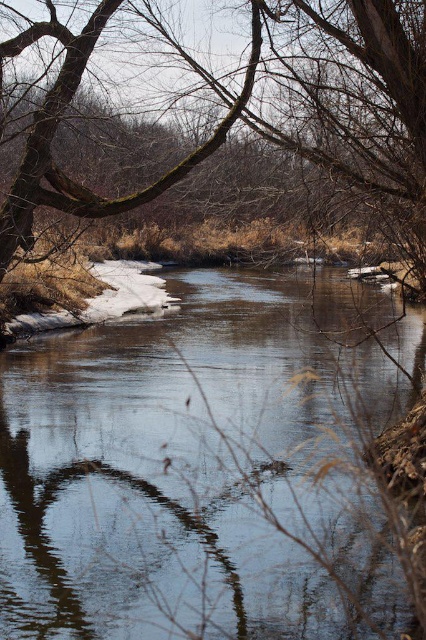
Question: Does clear water at center come behind brown mossy branch at upper left?

Choices:
 (A) yes
 (B) no

Answer: (B)

Question: Which of the following is the closest to the observer?

Choices:
 (A) clear water at center
 (B) brown mossy branch at upper left

Answer: (A)

Question: Is clear water at center positioned at the back of brown mossy branch at upper left?

Choices:
 (A) no
 (B) yes

Answer: (A)

Question: Is clear water at center smaller than brown mossy branch at upper left?

Choices:
 (A) no
 (B) yes

Answer: (A)